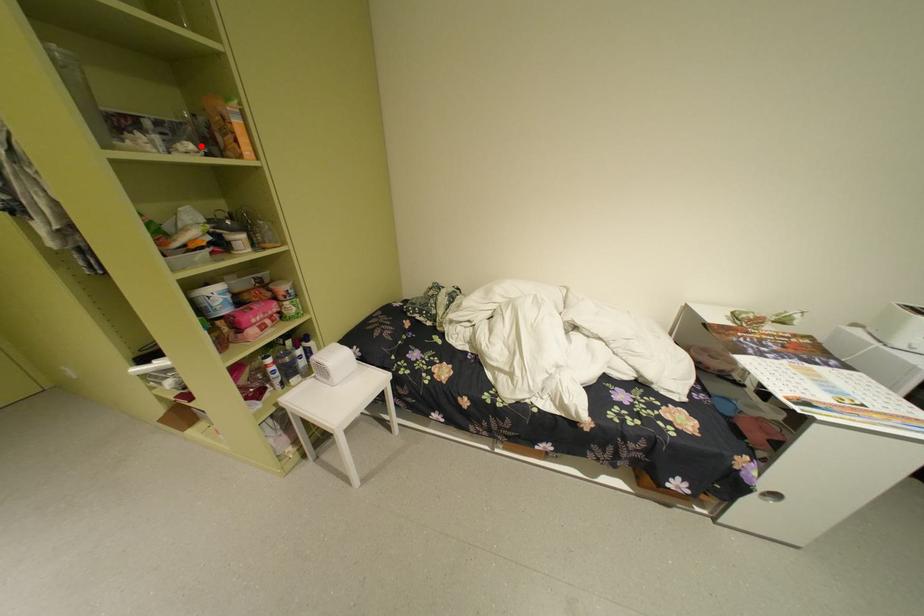
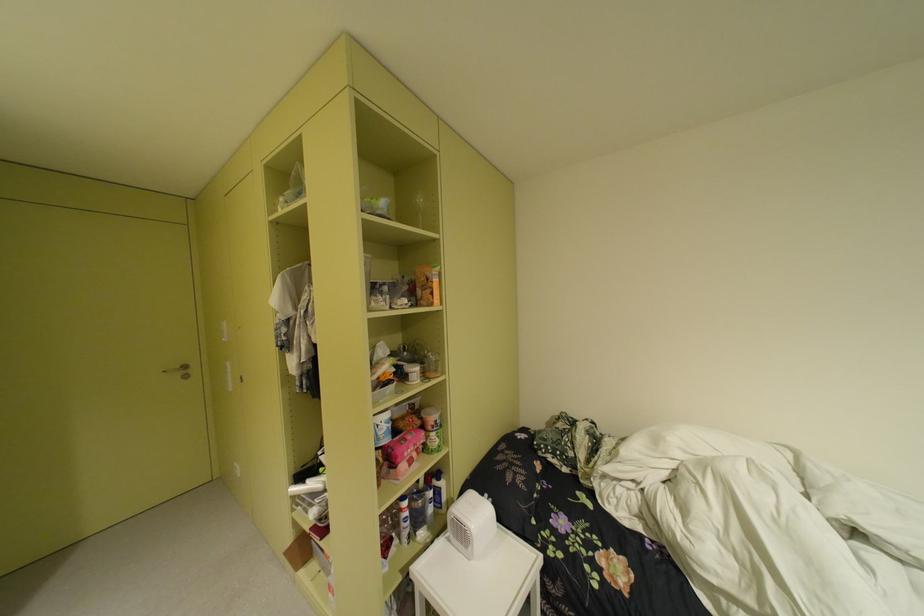
The point at the highlighted location is marked in the first image. Where is the corresponding point in the second image?

(417, 301)